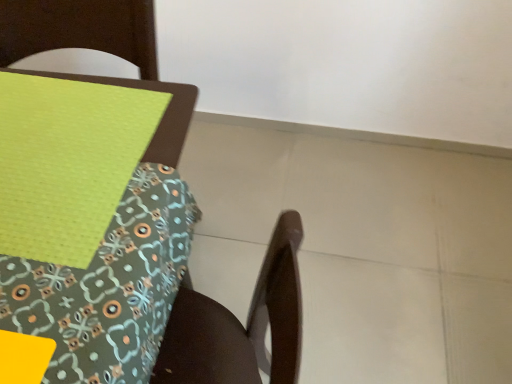
Question: From their relative heights in the image, would you say wooden chair at lower right is taller or shorter than green fabric placemat at upper left?

Choices:
 (A) tall
 (B) short

Answer: (A)

Question: From a real-world perspective, relative to green fabric placemat at upper left, is wooden chair at lower right vertically above or below?

Choices:
 (A) below
 (B) above

Answer: (A)

Question: In terms of size, does wooden chair at lower right appear bigger or smaller than green fabric placemat at upper left?

Choices:
 (A) big
 (B) small

Answer: (A)

Question: Does point (52, 233) appear closer or farther from the camera than point (51, 46)?

Choices:
 (A) closer
 (B) farther

Answer: (A)

Question: Which is correct: green fabric placemat at upper left is inside wooden chair at lower right, or outside of it?

Choices:
 (A) outside
 (B) inside

Answer: (A)

Question: Considering their positions, is green fabric placemat at upper left located in front of or behind wooden chair at lower right?

Choices:
 (A) front
 (B) behind

Answer: (B)

Question: Based on their positions, is green fabric placemat at upper left located to the left or right of wooden chair at lower right?

Choices:
 (A) right
 (B) left

Answer: (B)